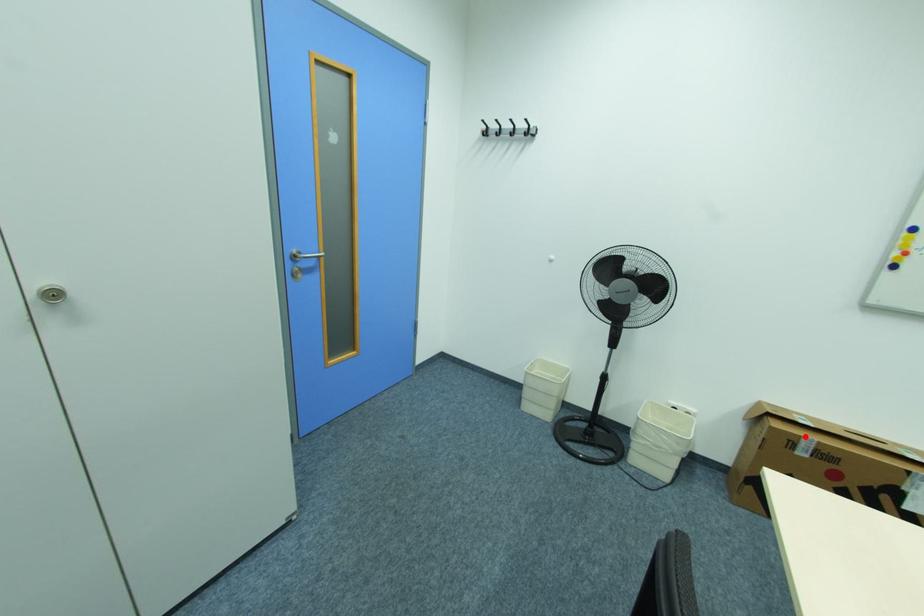
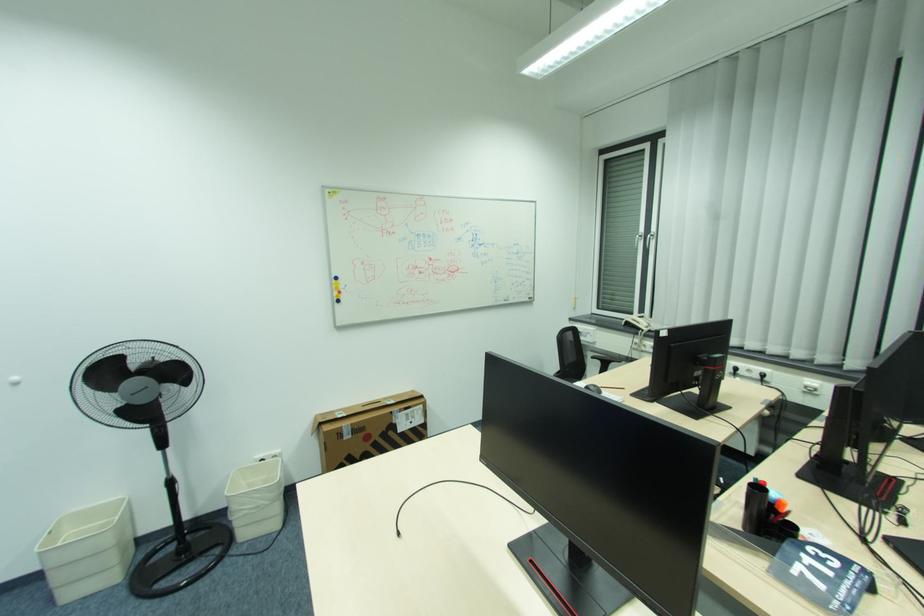
Where in the second image is the point corresponding to the highlighted location from the first image?

(346, 427)